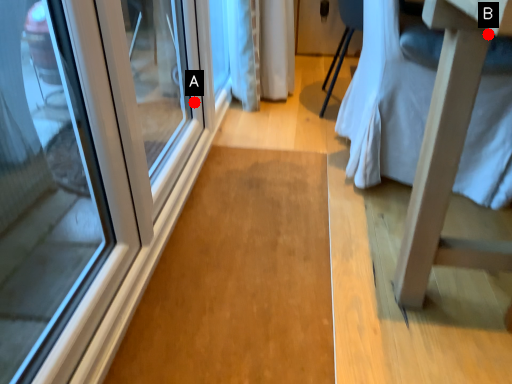
Question: Two points are circled on the image, labeled by A and B beside each circle. Which point is further to the camera?

Choices:
 (A) A is further
 (B) B is further

Answer: (A)